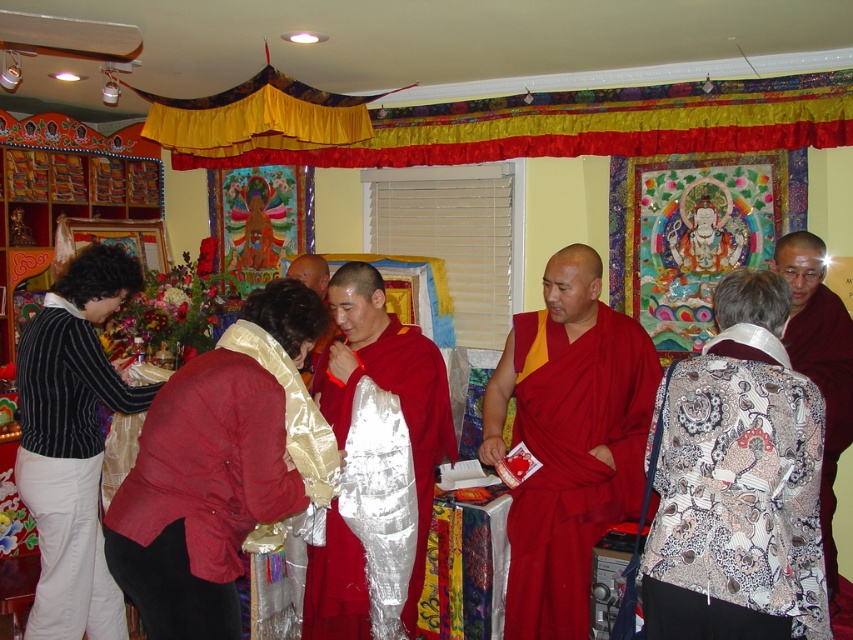
You are standing in the temple and want to place a small offering at the point marked by coordinates point (x=403, y=417). Based on the scene description, where exactly would this point be located?

The point (x=403, y=417) is on the shiny silver robe at center, so placing the offering there would mean placing it on the shiny silver robe at center.